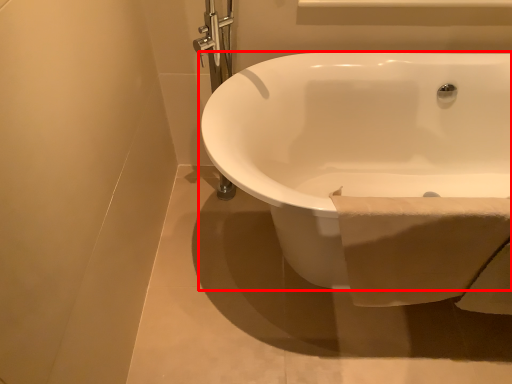
Question: Considering the relative positions of bathtub (annotated by the red box) and toilet paper in the image provided, where is bathtub (annotated by the red box) located with respect to the staircase?

Choices:
 (A) left
 (B) right

Answer: (B)